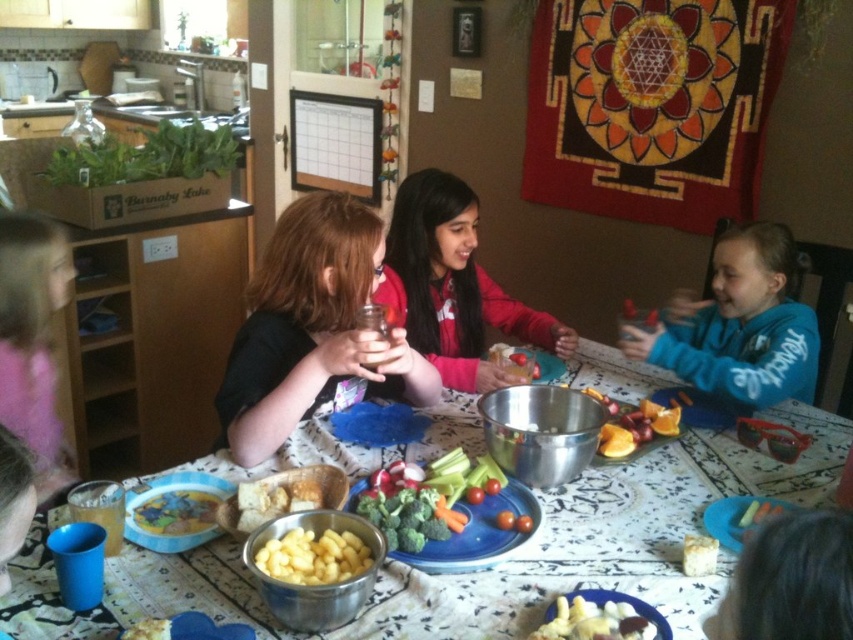
Is orange fleshed fruit at center positioned before yellow rubber duck at center?

No, orange fleshed fruit at center is behind yellow rubber duck at center.

Who is positioned more to the left, orange fleshed fruit at center or yellow rubber duck at center?

Positioned to the left is orange fleshed fruit at center.

At what (x,y) coordinates should I click in order to perform the action: click on orange fleshed fruit at center. Please return your answer as a coordinate pair (x, y). The width and height of the screenshot is (853, 640). Looking at the image, I should click on (633, 426).

Between point (428, 200) and point (492, 508), which one is positioned in front?

Point (492, 508)

Who is more distant from viewer, [477,291] or [518,538]?

Positioned behind is point [477,291].

The width and height of the screenshot is (853, 640). What are the coordinates of `matte red jacket at center` in the screenshot? It's located at (453, 285).

Does matte black shirt at center have a lesser width compared to yellow matte cheese at lower center?

In fact, matte black shirt at center might be wider than yellow matte cheese at lower center.

Is matte black shirt at center bigger than yellow matte cheese at lower center?

Indeed, matte black shirt at center has a larger size compared to yellow matte cheese at lower center.

Who is more distant from viewer, (x=370, y=253) or (x=576, y=636)?

Positioned behind is point (x=370, y=253).

Find the location of a particular element. The width and height of the screenshot is (853, 640). matte black shirt at center is located at coordinates (314, 330).